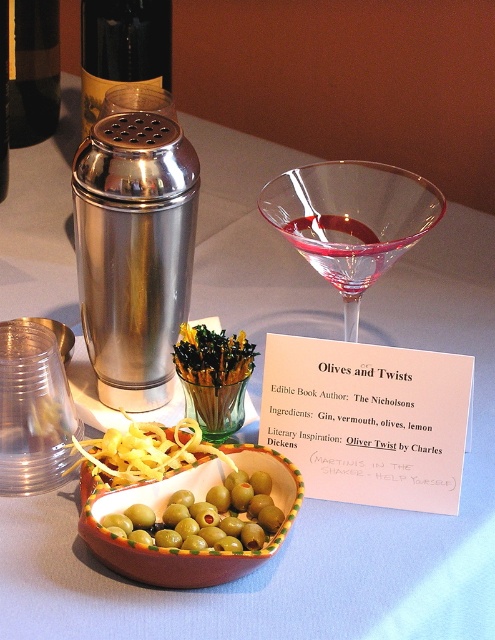
Question: Is brushed metal shaker at upper left wider than greensmootholives at center?

Choices:
 (A) yes
 (B) no

Answer: (A)

Question: Does brushed metal shaker at upper left have a larger size compared to greensmootholives at center?

Choices:
 (A) yes
 (B) no

Answer: (A)

Question: Can you confirm if green glazed bowl at center is thinner than yellow shredded cheese at center?

Choices:
 (A) no
 (B) yes

Answer: (A)

Question: Which point is farther from the camera taking this photo?

Choices:
 (A) click(x=52, y=131)
 (B) click(x=252, y=524)
 (C) click(x=178, y=444)

Answer: (A)

Question: Which is nearer to the shiny dark bottle at upper left?

Choices:
 (A) transparent glass martini at center
 (B) yellow shredded cheese at center
 (C) green glazed bowl at center

Answer: (A)

Question: Which of these objects is positioned closest to the greensmootholives at center?

Choices:
 (A) greenshinyolive at center
 (B) yellow shredded cheese at center

Answer: (B)